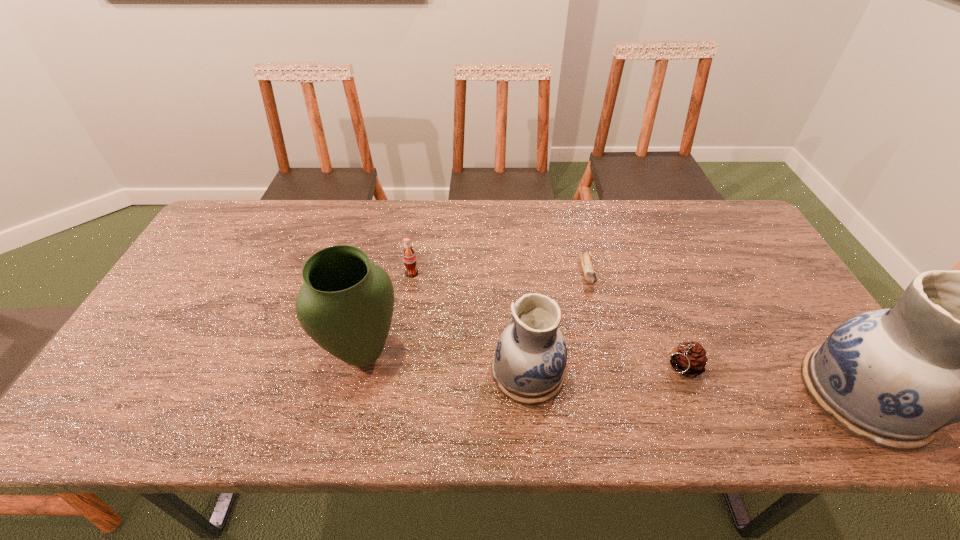
Please point a free position for a pottery on the left. Please provide its 2D coordinates. Your answer should be formatted as a tuple, i.e. [(x, y)], where the tuple contains the x and y coordinates of a point satisfying the conditions above.

[(219, 350)]